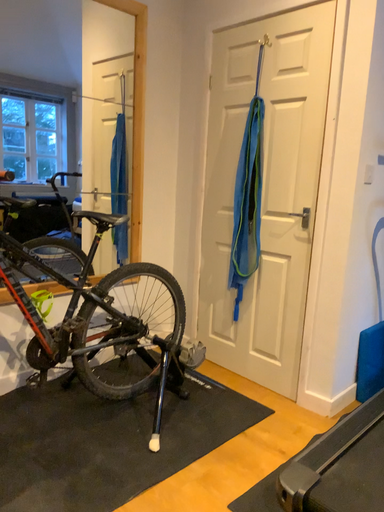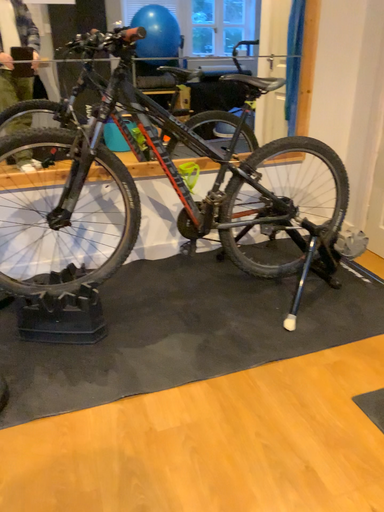
Question: Which way did the camera rotate in the video?

Choices:
 (A) rotated upward
 (B) rotated downward

Answer: (B)